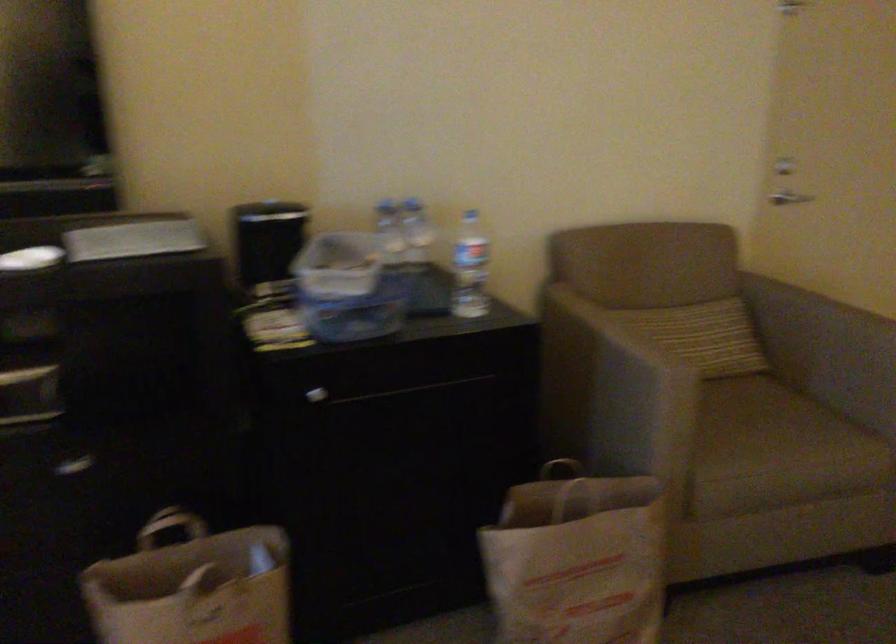
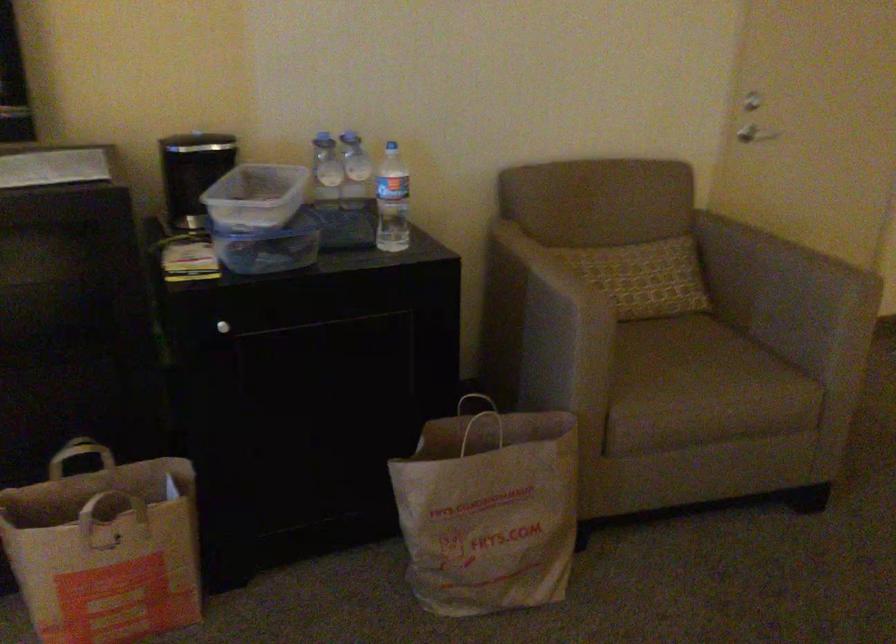
In the second image, find the point that corresponds to [421,237] in the first image.

(355, 171)